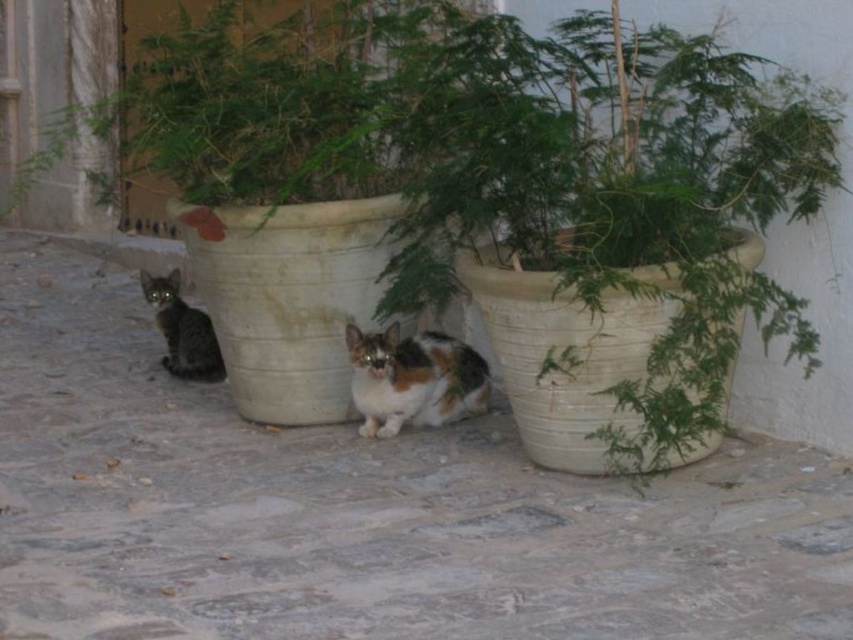
Which is in front, point (437, 333) or point (151, 300)?

Point (437, 333)

Find the location of a particular element. The height and width of the screenshot is (640, 853). calico fur cat at center is located at coordinates (413, 380).

Locate an element on the screen. The image size is (853, 640). calico fur cat at center is located at coordinates (413, 380).